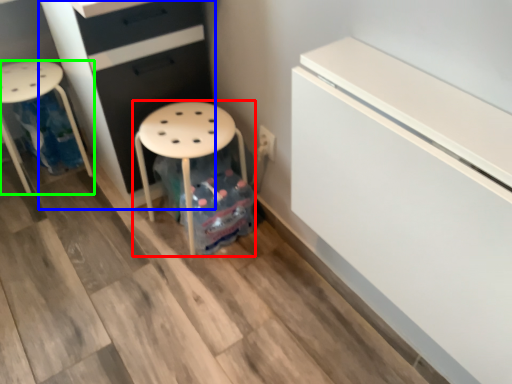
Question: Estimate the real-world distances between objects in this image. Which object is closer to stool (highlighted by a red box), chest of drawers (highlighted by a blue box) or furniture (highlighted by a green box)?

Choices:
 (A) chest of drawers
 (B) furniture

Answer: (A)